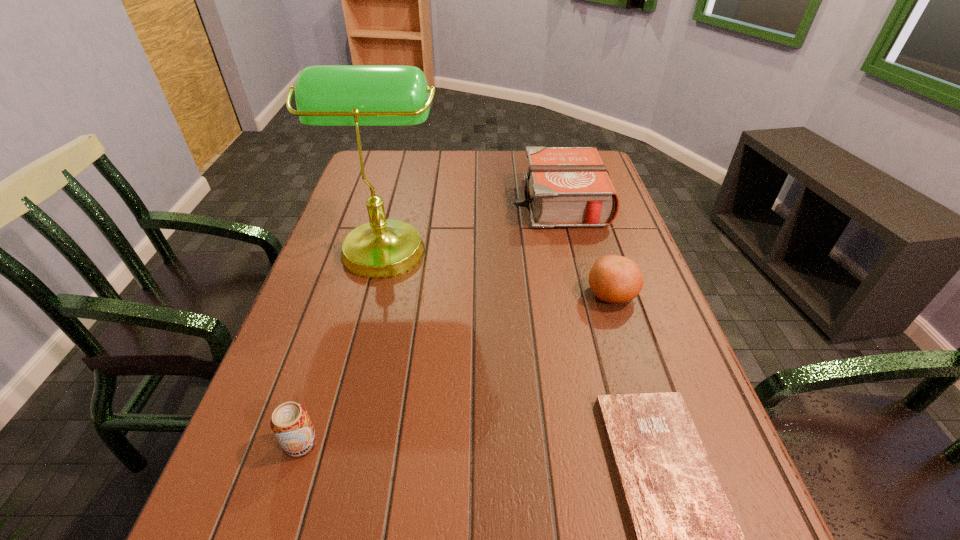
The width and height of the screenshot is (960, 540). What are the coordinates of `lamp at the left edge` in the screenshot? It's located at (326, 95).

Locate an element on the screen. beer can located at the left edge is located at coordinates (291, 424).

Find the location of a particular element. Bible located in the right edge section of the desktop is located at coordinates pyautogui.click(x=565, y=186).

Where is `clementine that is at the right edge`? clementine that is at the right edge is located at coordinates (614, 279).

The image size is (960, 540). I want to click on object at the far right corner, so click(565, 186).

This screenshot has width=960, height=540. What are the coordinates of `free space at the far edge of the desktop` in the screenshot? It's located at (517, 159).

In the image, there is a desktop. Identify the location of vacant space at the right edge. The height and width of the screenshot is (540, 960). (742, 531).

In the image, there is a desktop. In order to click on vacant space at the far left corner in this screenshot , I will do `click(388, 160)`.

You are a GUI agent. You are given a task and a screenshot of the screen. Output one action in this format:
    pyautogui.click(x=<x>, y=<y>)
    Task: Click on the empty location between the farther Bible and the lamp
    Image resolution: width=960 pixels, height=540 pixels.
    Given the screenshot: What is the action you would take?
    pyautogui.click(x=472, y=223)

The width and height of the screenshot is (960, 540). Find the location of `vacant space in between the tallest object and the beer can`. vacant space in between the tallest object and the beer can is located at coordinates tap(344, 344).